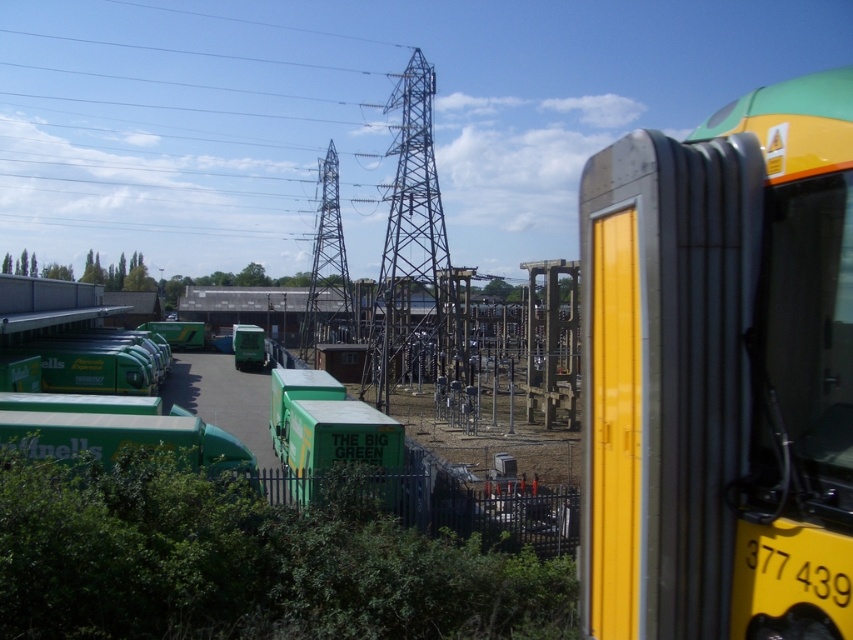
Who is higher up, yellow metallic bus at right or green matte truck at center?

yellow metallic bus at right

Who is more distant from viewer, (666, 294) or (254, 332)?

The point (254, 332) is behind.

What do you see at coordinates (720, 372) in the screenshot? I see `yellow metallic bus at right` at bounding box center [720, 372].

In order to click on yellow metallic bus at right in this screenshot , I will do 720,372.

Describe the element at coordinates (328, 268) in the screenshot. I see `metallic silver tower at center` at that location.

Image resolution: width=853 pixels, height=640 pixels. I want to click on metallic silver tower at center, so click(328, 268).

Who is more forward, (844, 545) or (326, 316)?

Positioned in front is point (844, 545).

Who is taller, yellow metallic bus at right or metallic silver tower at center?

Standing taller between the two is metallic silver tower at center.

The height and width of the screenshot is (640, 853). What do you see at coordinates (720, 372) in the screenshot? I see `yellow metallic bus at right` at bounding box center [720, 372].

Identify the location of yellow metallic bus at right. (720, 372).